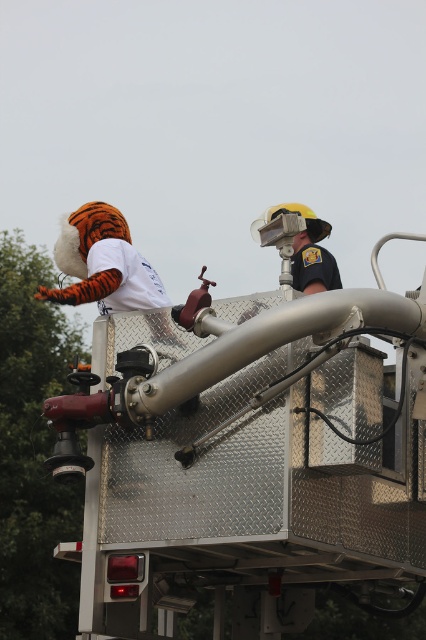
Question: Does orange plush tiger at upper left come in front of matte black helmet at upper center?

Choices:
 (A) yes
 (B) no

Answer: (A)

Question: Is orange plush tiger at upper left thinner than matte black helmet at upper center?

Choices:
 (A) no
 (B) yes

Answer: (A)

Question: Among these objects, which one is nearest to the camera?

Choices:
 (A) matte black helmet at upper center
 (B) orange plush tiger at upper left

Answer: (B)

Question: Does orange plush tiger at upper left appear on the left side of matte black helmet at upper center?

Choices:
 (A) no
 (B) yes

Answer: (B)